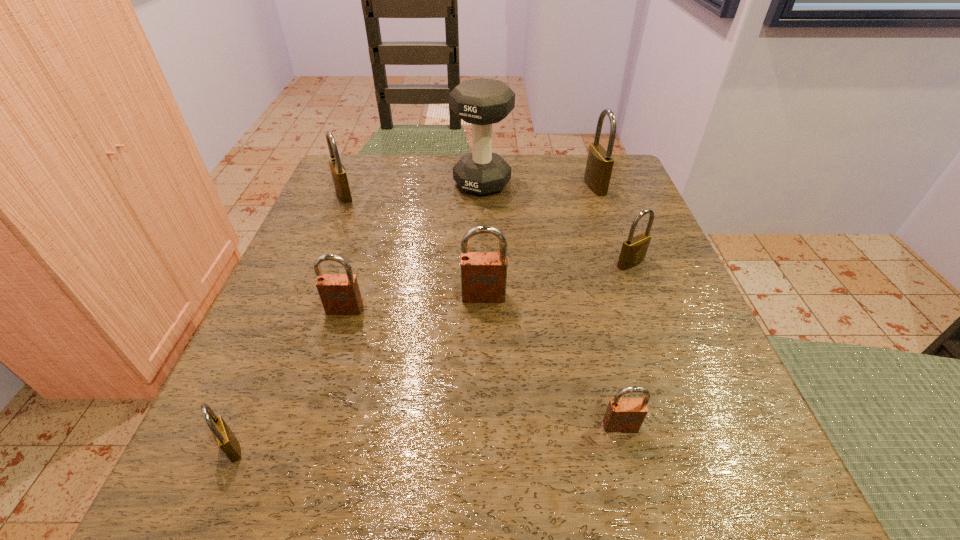
Identify which brown padlock is the second nearest to the second smallest brown padlock. Please provide its 2D coordinates. Your answer should be formatted as a tuple, i.e. [(x, y)], where the tuple contains the x and y coordinates of a point satisfying the conditions above.

[(623, 415)]